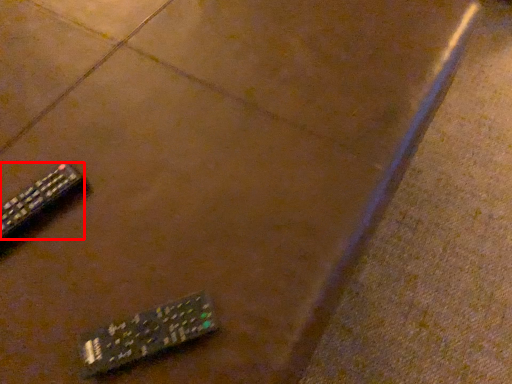
Question: From the image's perspective, where is remote control (annotated by the red box) located in relation to remote control in the image?

Choices:
 (A) above
 (B) below

Answer: (A)